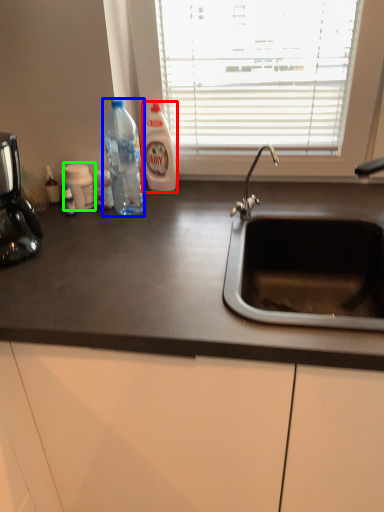
Question: Which object is positioned farthest from cleaning product (highlighted by a red box)? Select from bottle (highlighted by a blue box) and bottle (highlighted by a green box).

Choices:
 (A) bottle
 (B) bottle

Answer: (B)